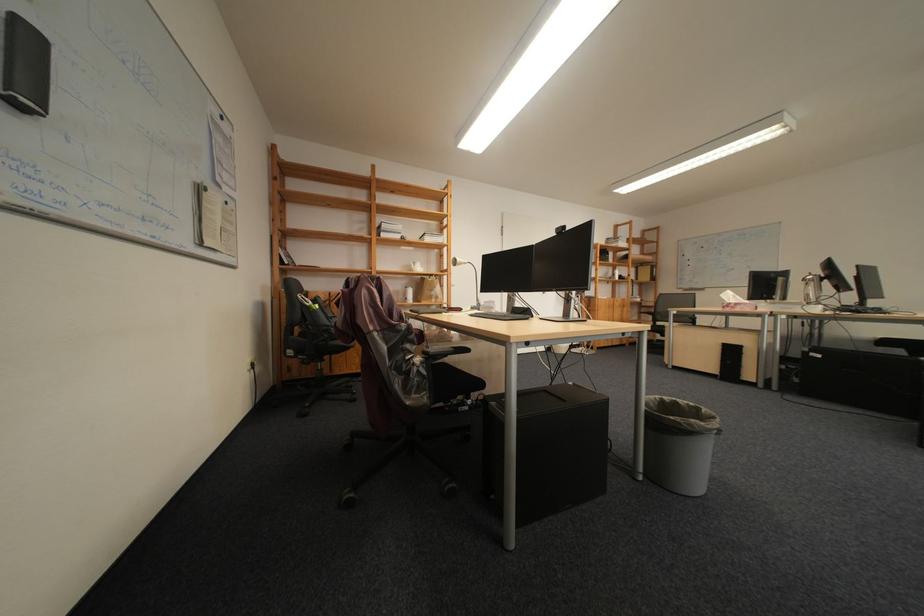
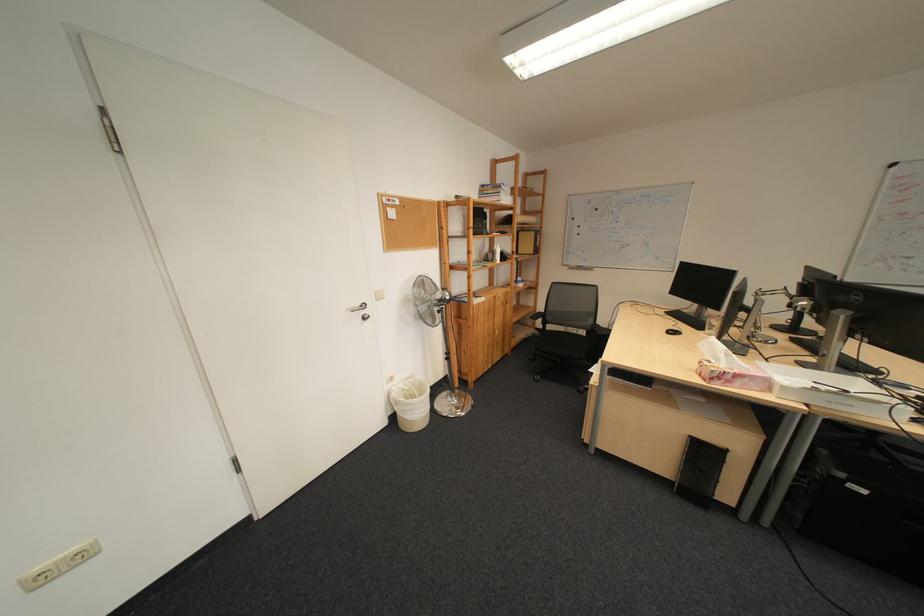
Locate, in the second image, the point that corresponds to [786,314] in the first image.

(821, 407)